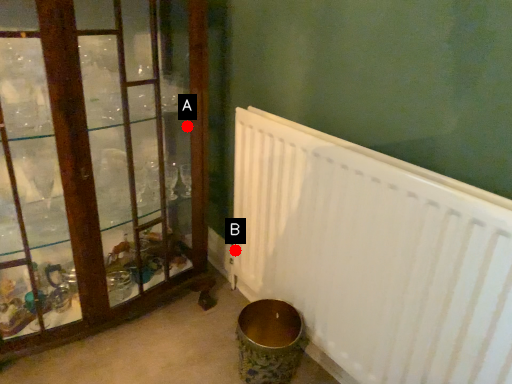
Question: Two points are circled on the image, labeled by A and B beside each circle. Which point appears farthest from the camera in this image?

Choices:
 (A) A is further
 (B) B is further

Answer: (A)